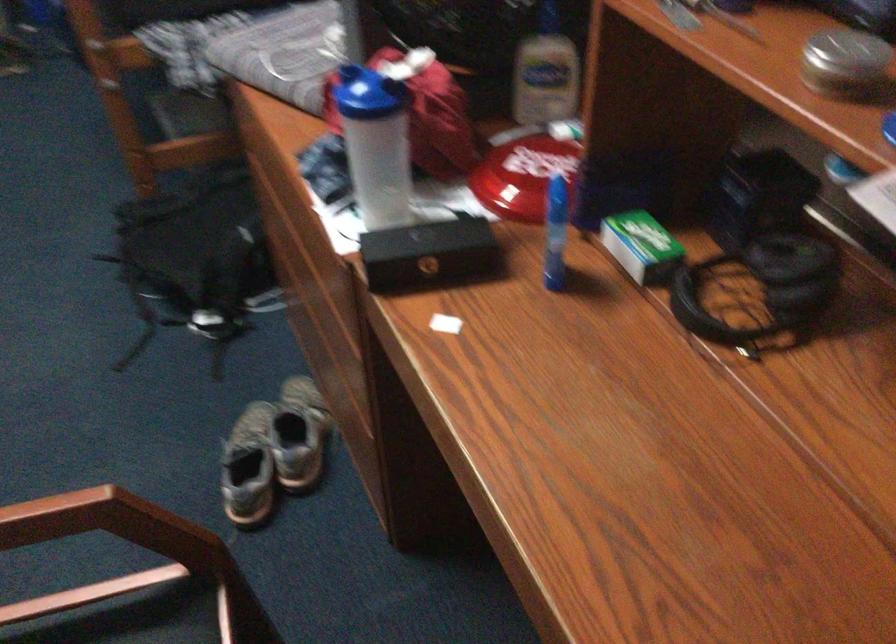
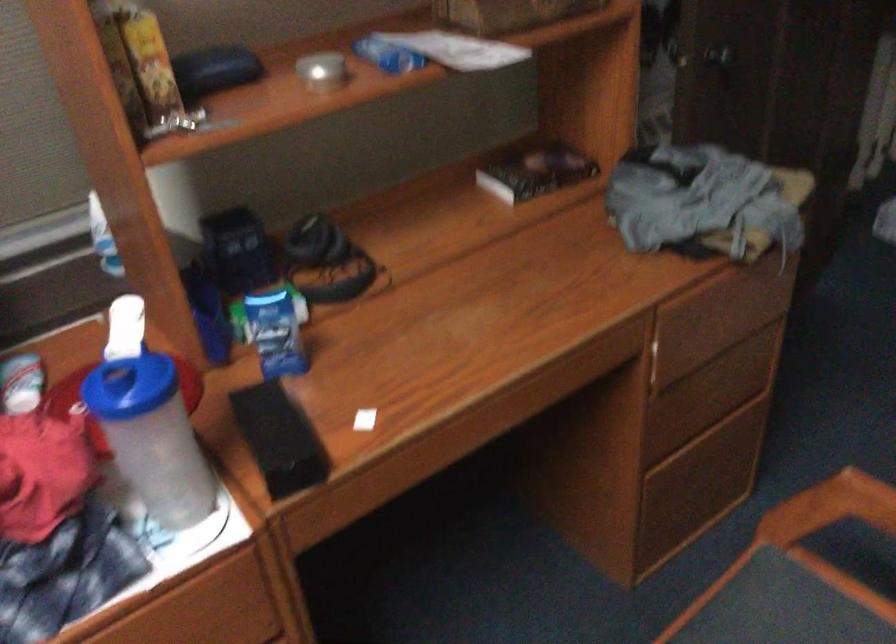
Locate, in the second image, the point that corresponds to pixel 349 146 in the first image.

(151, 437)